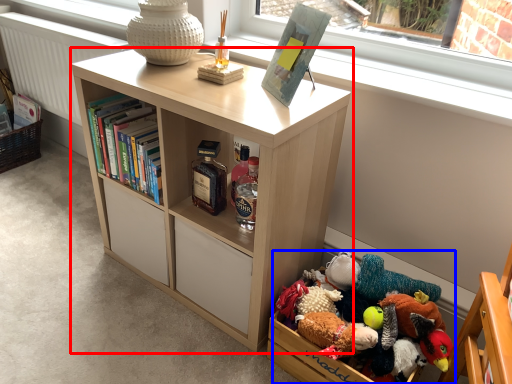
Question: Which object appears closest to the camera in this image, bookcase (highlighted by a red box) or toy (highlighted by a blue box)?

Choices:
 (A) bookcase
 (B) toy

Answer: (A)